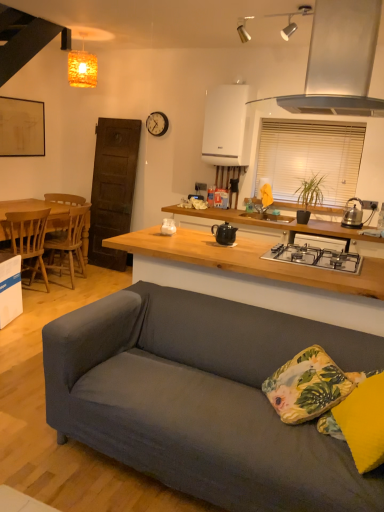
Question: Does wooden table at left have a lesser height compared to white glossy coffee cup at center?

Choices:
 (A) no
 (B) yes

Answer: (A)

Question: Is wooden table at left touching white glossy coffee cup at center?

Choices:
 (A) no
 (B) yes

Answer: (A)

Question: From the image's perspective, does wooden table at left appear lower than white glossy coffee cup at center?

Choices:
 (A) yes
 (B) no

Answer: (A)

Question: From a real-world perspective, is wooden table at left over white glossy coffee cup at center?

Choices:
 (A) no
 (B) yes

Answer: (A)

Question: Does wooden table at left have a lesser width compared to white glossy coffee cup at center?

Choices:
 (A) yes
 (B) no

Answer: (B)

Question: Can you confirm if wooden table at left is bigger than white glossy coffee cup at center?

Choices:
 (A) no
 (B) yes

Answer: (B)

Question: Is metallic black kettle at right facing towards white glossy cabinet at upper center?

Choices:
 (A) no
 (B) yes

Answer: (A)

Question: Can you confirm if metallic black kettle at right is bigger than white glossy cabinet at upper center?

Choices:
 (A) yes
 (B) no

Answer: (B)

Question: Is the surface of metallic black kettle at right in direct contact with white glossy cabinet at upper center?

Choices:
 (A) no
 (B) yes

Answer: (A)

Question: From the image's perspective, would you say metallic black kettle at right is shown under white glossy cabinet at upper center?

Choices:
 (A) no
 (B) yes

Answer: (B)

Question: From the image's perspective, is metallic black kettle at right on white glossy cabinet at upper center?

Choices:
 (A) yes
 (B) no

Answer: (B)

Question: Does metallic black kettle at right have a lesser width compared to white glossy cabinet at upper center?

Choices:
 (A) yes
 (B) no

Answer: (A)

Question: Considering the relative positions of matte yellow pillow at lower right, the 2th pillow viewed from the back, and floral fabric pillow at lower right, which is the second pillow in front-to-back order, in the image provided, is matte yellow pillow at lower right, the 2th pillow viewed from the back, to the right of floral fabric pillow at lower right, which is the second pillow in front-to-back order, from the viewer's perspective?

Choices:
 (A) yes
 (B) no

Answer: (A)